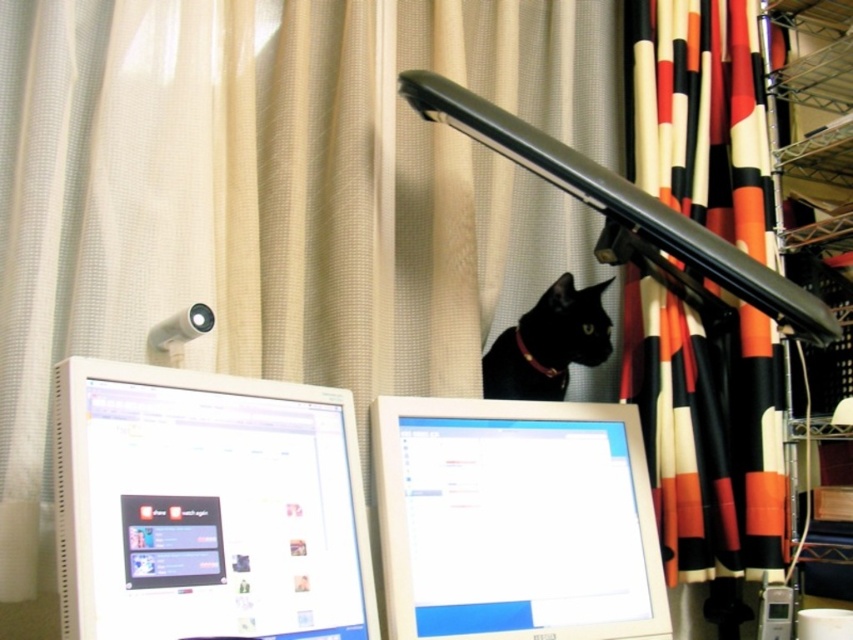
Between point (228, 476) and point (763, 556), which one is positioned behind?

The point (763, 556) is more distant.

Consider the image. Does white glossy computer monitor at lower left have a smaller size compared to black and white striped curtain at right?

Indeed, white glossy computer monitor at lower left has a smaller size compared to black and white striped curtain at right.

Between point (202, 573) and point (715, 563), which one is positioned in front?

Point (202, 573)

Image resolution: width=853 pixels, height=640 pixels. Find the location of `white glossy computer monitor at lower left`. white glossy computer monitor at lower left is located at coordinates (207, 506).

Does white glossy computer monitor at lower left come behind white glossy computer monitor at center?

That is False.

Is the position of white glossy computer monitor at lower left less distant than that of white glossy computer monitor at center?

Yes, white glossy computer monitor at lower left is in front of white glossy computer monitor at center.

This screenshot has width=853, height=640. I want to click on white glossy computer monitor at lower left, so click(207, 506).

Find the location of a particular element. The height and width of the screenshot is (640, 853). white glossy computer monitor at lower left is located at coordinates (207, 506).

Can you confirm if white glossy computer monitor at lower left is thinner than black glossy cat at upper center?

No.

Which is below, white glossy computer monitor at lower left or black glossy cat at upper center?

Positioned lower is white glossy computer monitor at lower left.

Is point (303, 488) farther from viewer compared to point (515, 380)?

No, (303, 488) is closer to viewer.

Where is `white glossy computer monitor at lower left`? Image resolution: width=853 pixels, height=640 pixels. white glossy computer monitor at lower left is located at coordinates (207, 506).